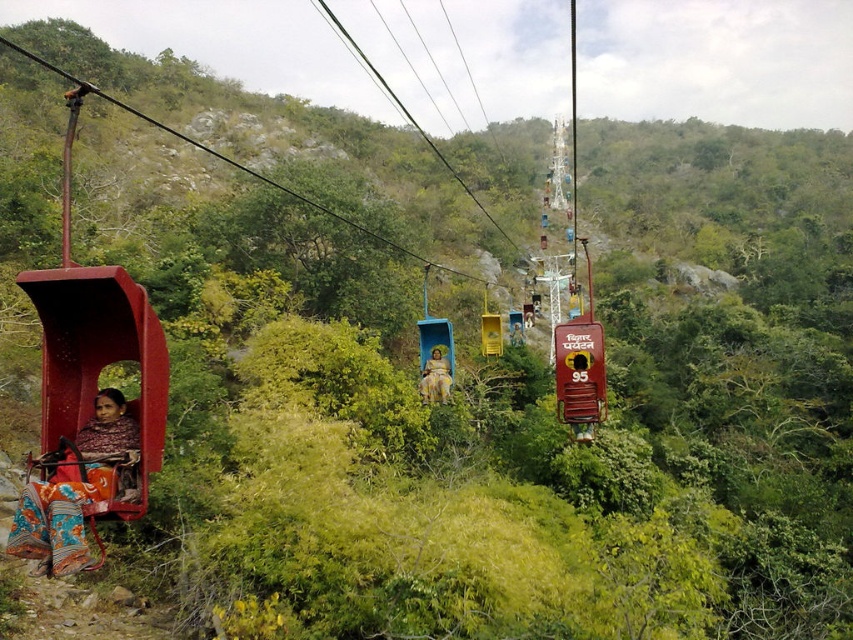
Does metallic blue chair at center have a greater width compared to yellow matte lift at center?

Yes.

Is metallic blue chair at center thinner than yellow matte lift at center?

No.

You are a GUI agent. You are given a task and a screenshot of the screen. Output one action in this format:
    pyautogui.click(x=<x>, y=<y>)
    Task: Click on the metallic blue chair at center
    Image resolution: width=853 pixels, height=640 pixels.
    Given the screenshot: What is the action you would take?
    pyautogui.click(x=572, y=288)

Identify the location of metallic blue chair at center. The width and height of the screenshot is (853, 640). (572, 288).

Can you confirm if metallic blue chair at center is positioned to the left of yellow fabric dress at center?

Correct, you'll find metallic blue chair at center to the left of yellow fabric dress at center.

Does metallic blue chair at center have a greater width compared to yellow fabric dress at center?

Correct, the width of metallic blue chair at center exceeds that of yellow fabric dress at center.

Does point (556, 404) come farther from viewer compared to point (521, 339)?

No, it is in front of (521, 339).

This screenshot has height=640, width=853. Find the location of `metallic blue chair at center`. metallic blue chair at center is located at coordinates (572, 288).

Which is more to the left, yellow satin dress at center or yellow fabric dress at center?

Positioned to the left is yellow satin dress at center.

Between point (430, 400) and point (520, 314), which one is positioned behind?

Point (520, 314)

The height and width of the screenshot is (640, 853). What do you see at coordinates (436, 376) in the screenshot? I see `yellow satin dress at center` at bounding box center [436, 376].

Where is `yellow satin dress at center`? The height and width of the screenshot is (640, 853). yellow satin dress at center is located at coordinates (436, 376).